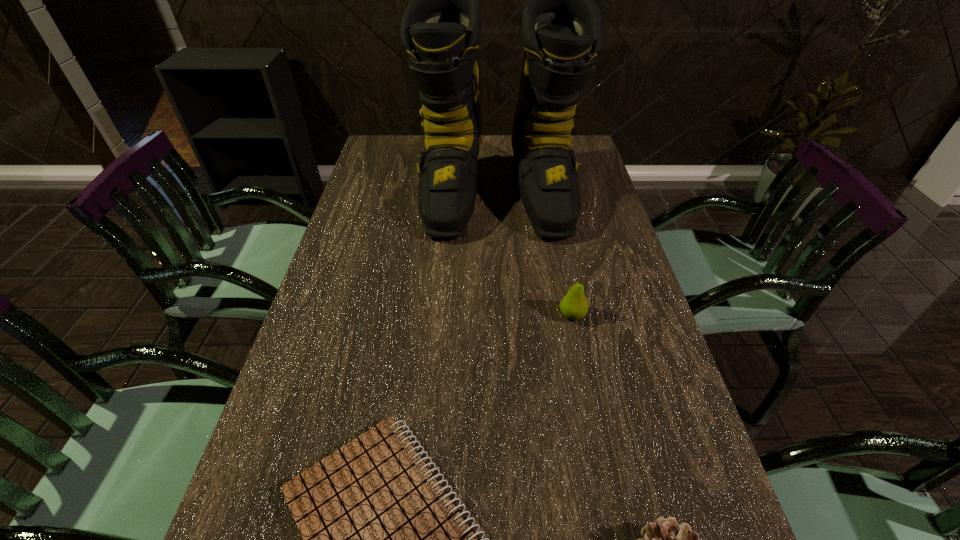
This screenshot has width=960, height=540. In order to click on the tallest object in this screenshot , I will do `click(441, 28)`.

You are a GUI agent. You are given a task and a screenshot of the screen. Output one action in this format:
    pyautogui.click(x=<x>, y=<y>)
    Task: Click on the ski boots
    This screenshot has height=540, width=960.
    Given the screenshot: What is the action you would take?
    pyautogui.click(x=441, y=28)

Identify the location of pear. This screenshot has height=540, width=960. (574, 305).

Identify the location of the third shortest object. This screenshot has width=960, height=540. (574, 305).

You are a GUI agent. You are given a task and a screenshot of the screen. Output one action in this format:
    pyautogui.click(x=<x>, y=<y>)
    Task: Click on the vacant region located on the left of the farthest object
    
    Given the screenshot: What is the action you would take?
    pyautogui.click(x=359, y=198)

Locate an element on the screen. This screenshot has height=540, width=960. vacant space situated 0.330m on the left of the second tallest object is located at coordinates (423, 315).

Locate an element on the screen. Image resolution: width=960 pixels, height=540 pixels. object that is at the far edge is located at coordinates (441, 28).

At what (x,y) coordinates should I click in order to perform the action: click on ski boots positioned at the right edge. Please return your answer as a coordinate pair (x, y). The image size is (960, 540). Looking at the image, I should click on coord(441,28).

This screenshot has width=960, height=540. Find the location of `pear located at the right edge`. pear located at the right edge is located at coordinates (574, 305).

Find the location of a particular element. This screenshot has width=960, height=540. object present at the far right corner is located at coordinates (441, 28).